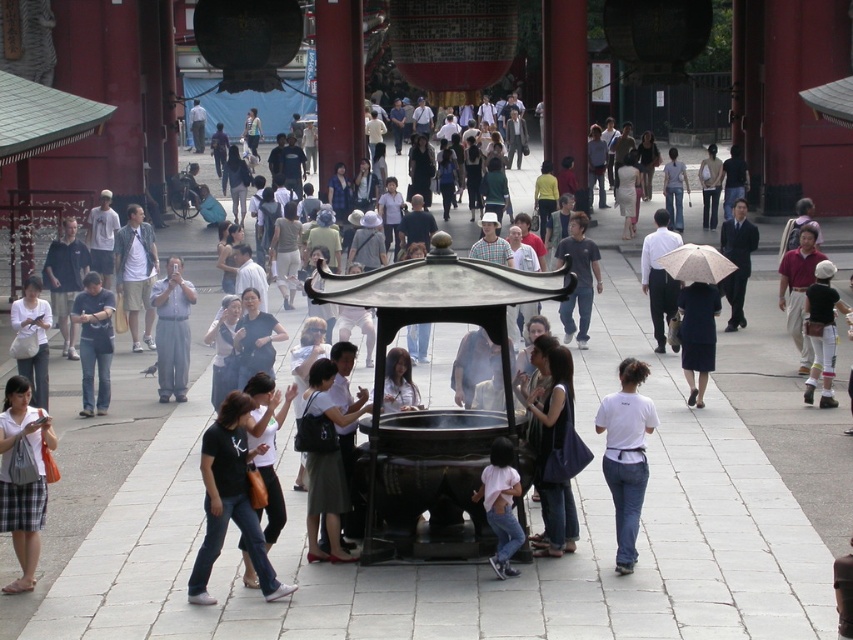
You are a visitor at the temple and notice two people in the scene. One is wearing a white fabric shirt at lower left and the other has denim jeans at left. From your perspective, which person is positioned more to the left?

The denim jeans at left is positioned more to the left since the white fabric shirt at lower left is to the right of denim jeans at left.

You are a photographer positioned at the entrance of the temple, aiming to capture a clear shot of the large dark incense burner in the center. However, two people are blocking your view. The first person wears a white fabric shirt at lower left, and the second wears denim jeans at left. Which of these two people is closer to the camera, potentially obstructing your view more?

The white fabric shirt at lower left is in front of the denim jeans at left, meaning it is closer to the camera and thus more obstructing the view of the large dark incense burner in the center.

You are standing at the entrance of the temple and want to find the black fabric shirt at center. According to the coordinates provided, in which direction should you look to locate it?

The black fabric shirt at center is located at coordinates point [230,500], which means it is positioned towards the lower right direction from your current position at the entrance.